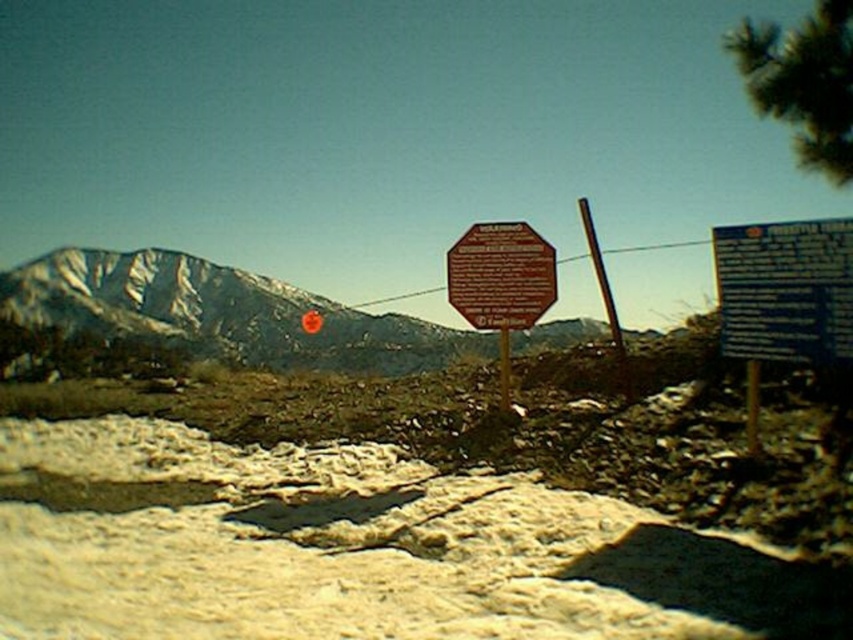
You are an outdoor enthusiast planning to set up a tent in this mountainous area. Given the presence of the green textured pine at upper right and the metallic pole at center, which object would you consider for securing your tent stakes to ensure stability? Explain your choice based on their widths.

The green textured pine at upper right is wider than the metallic pole at center. Therefore, the pine would provide a more stable anchor point for securing tent stakes due to its greater width and likely stronger root system.

You are a hiker planning to traverse the rugged terrain in the image. You see the snowy rocky mountain at center marked by point [219,312]. What is the significance of this point in the scene?

The point [219,312] marks the location of the snowy rocky mountain at center, indicating its central position in the scene.

You are hiking and need to take a photo of the metallic pole at center. To ensure it is fully visible in the frame, should you move closer to or farther away from the green textured pine at upper right?

The green textured pine at upper right is in front of the metallic pole at center. To ensure the metallic pole at center is fully visible, you should move closer to the green textured pine at upper right so that it moves out of the way or becomes smaller in the frame, allowing the pole to be seen clearly.